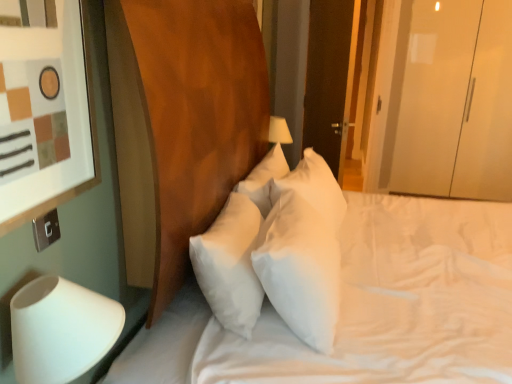
Identify the location of white soft pillow at center. Image resolution: width=512 pixels, height=384 pixels. (303, 250).

Measure the distance between point (259, 238) and camera.

Point (259, 238) and camera are 1.54 meters apart.

What do you see at coordinates (46, 230) in the screenshot? The height and width of the screenshot is (384, 512). I see `silver metallic switch at lower left` at bounding box center [46, 230].

In order to click on transparent glossy wardrobe at right in this screenshot , I will do `click(453, 100)`.

Image resolution: width=512 pixels, height=384 pixels. What do you see at coordinates (45, 117) in the screenshot? I see `matte white picture frame at left` at bounding box center [45, 117].

Where is `dark wood door at upper right`? dark wood door at upper right is located at coordinates (330, 78).

What do you see at coordinates (330, 78) in the screenshot? Image resolution: width=512 pixels, height=384 pixels. I see `dark wood door at upper right` at bounding box center [330, 78].

Describe the element at coordinates (394, 303) in the screenshot. This screenshot has height=384, width=512. I see `white soft mattress at center` at that location.

You are a GUI agent. You are given a task and a screenshot of the screen. Output one action in this format:
    pyautogui.click(x=<x>, y=<y>)
    Task: Click on the white matte table lamp at lower left
    Image resolution: width=512 pixels, height=384 pixels.
    Given the screenshot: What is the action you would take?
    pyautogui.click(x=61, y=330)

In order to click on white soft pillow at center in this screenshot , I will do `click(303, 250)`.

Is matte white picture frame at left positioned in front of transparent glossy wardrobe at right?

Yes, it is in front of transparent glossy wardrobe at right.

In the scene shown: From the image's perspective, is matte white picture frame at left located above or below transparent glossy wardrobe at right?

From the image's perspective, matte white picture frame at left appears below transparent glossy wardrobe at right.

Considering the sizes of objects matte white picture frame at left and transparent glossy wardrobe at right in the image provided, who is wider, matte white picture frame at left or transparent glossy wardrobe at right?

With larger width is transparent glossy wardrobe at right.

Does matte white picture frame at left touch transparent glossy wardrobe at right?

No, matte white picture frame at left is not making contact with transparent glossy wardrobe at right.

Is transparent glossy wardrobe at right far away from white soft pillow at center?

That's right, there is a large distance between transparent glossy wardrobe at right and white soft pillow at center.

Between transparent glossy wardrobe at right and white soft pillow at center, which one has more height?

transparent glossy wardrobe at right is taller.

From the image's perspective, relative to white soft pillow at center, is transparent glossy wardrobe at right above or below?

From the image's perspective, transparent glossy wardrobe at right appears above white soft pillow at center.

Image resolution: width=512 pixels, height=384 pixels. Identify the location of glass door to the right of white soft pillow at center. (453, 100).

Is transparent glossy wardrobe at right in contact with white matte table lamp at lower left?

No.

From the image's perspective, is transparent glossy wardrobe at right located above or below white matte table lamp at lower left?

From the image's perspective, transparent glossy wardrobe at right appears above white matte table lamp at lower left.

Does point (400, 142) appear closer or farther from the camera than point (81, 366)?

Point (400, 142) is positioned farther from the camera compared to point (81, 366).

Image resolution: width=512 pixels, height=384 pixels. Identify the location of glass door positioned vertically above the white matte table lamp at lower left (from a real-world perspective). coord(453,100).

How many degrees apart are the facing directions of white soft pillow at center and dark wood door at upper right?

25.9 degrees.

Which object is closer to the camera taking this photo, white soft pillow at center or dark wood door at upper right?

white soft pillow at center is closer to the camera.

Is dark wood door at upper right surrounded by white soft pillow at center?

Actually, dark wood door at upper right is outside white soft pillow at center.

Which point is more forward, (309, 151) or (318, 120)?

The point (309, 151) is in front.

Considering the relative sizes of white soft mattress at center and transparent glossy wardrobe at right in the image provided, is white soft mattress at center taller than transparent glossy wardrobe at right?

No.

Does point (263, 334) appear closer or farther from the camera than point (417, 89)?

Point (263, 334) is positioned closer to the camera compared to point (417, 89).

Is white soft mattress at center at the left side of transparent glossy wardrobe at right?

Correct, you'll find white soft mattress at center to the left of transparent glossy wardrobe at right.

Are white soft pillow at center and white soft mattress at center far apart?

Actually, white soft pillow at center and white soft mattress at center are a little close together.

From the image's perspective, is white soft pillow at center on white soft mattress at center?

Indeed, from the image's perspective, white soft pillow at center is shown above white soft mattress at center.

Considering the relative sizes of white soft pillow at center and white soft mattress at center in the image provided, is white soft pillow at center bigger than white soft mattress at center?

No.

Does point (328, 228) come behind point (507, 206)?

No, it is in front of (507, 206).

From a real-world perspective, which is physically below, white soft mattress at center or dark wood door at upper right?

white soft mattress at center, from a real-world perspective.

Which of these two, white soft mattress at center or dark wood door at upper right, is bigger?

white soft mattress at center.

From their relative heights in the image, would you say white soft mattress at center is taller or shorter than dark wood door at upper right?

Clearly, white soft mattress at center is shorter compared to dark wood door at upper right.

Locate an element on the screen. picture frame on the left of transparent glossy wardrobe at right is located at coordinates (45, 117).

Identify the location of glass door positioned vertically above the white soft pillow at center (from a real-world perspective). This screenshot has width=512, height=384. 453,100.

When comparing their distances from white matte table lamp at lower left, does white soft pillow at center or matte white picture frame at left seem further?

white soft pillow at center is positioned further to the anchor white matte table lamp at lower left.

Based on their spatial positions, is dark wood door at upper right or white soft mattress at center further from white soft pillow at center?

Among the two, dark wood door at upper right is located further to white soft pillow at center.

When comparing their distances from matte white picture frame at left, does transparent glossy wardrobe at right or dark wood door at upper right seem further?

The object further to matte white picture frame at left is transparent glossy wardrobe at right.

When comparing their distances from white matte table lamp at lower left, does matte white picture frame at left or dark wood door at upper right seem further?

dark wood door at upper right lies further to white matte table lamp at lower left than the other object.

In the scene shown: From the image, which object appears to be farther from white soft pillow at center, matte white picture frame at left or silver metallic switch at lower left?

Based on the image, silver metallic switch at lower left appears to be further to white soft pillow at center.

Looking at the image, which one is located closer to silver metallic switch at lower left, transparent glossy wardrobe at right or white matte table lamp at lower left?

white matte table lamp at lower left.

Based on the photo, when comparing their distances from white soft mattress at center, does transparent glossy wardrobe at right or white soft pillow at center seem closer?

white soft pillow at center is positioned closer to the anchor white soft mattress at center.

Looking at the image, which one is located further to transparent glossy wardrobe at right, matte white picture frame at left or white matte table lamp at lower left?

Based on the image, white matte table lamp at lower left appears to be further to transparent glossy wardrobe at right.

I want to click on electric outlet between white matte table lamp at lower left and transparent glossy wardrobe at right in the front-back direction, so point(46,230).

I want to click on electric outlet between white soft mattress at center and dark wood door at upper right in the front-back direction, so click(x=46, y=230).

This screenshot has height=384, width=512. Identify the location of picture frame located between silver metallic switch at lower left and white soft pillow at center in the left-right direction. (45, 117).

The image size is (512, 384). In order to click on pillow between matte white picture frame at left and white soft mattress at center from left to right in this screenshot , I will do `click(303, 250)`.